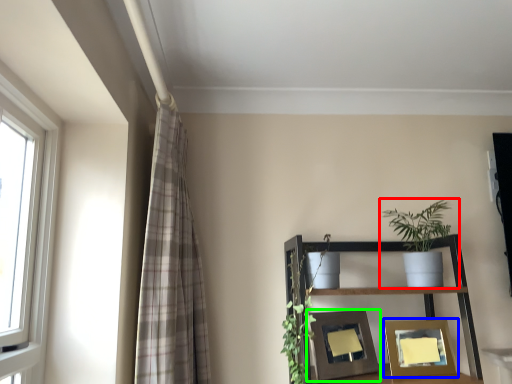
Question: Estimate the real-world distances between objects in this image. Which object is closer to houseplant (highlighted by a red box), picture frame (highlighted by a blue box) or picture frame (highlighted by a green box)?

Choices:
 (A) picture frame
 (B) picture frame

Answer: (A)